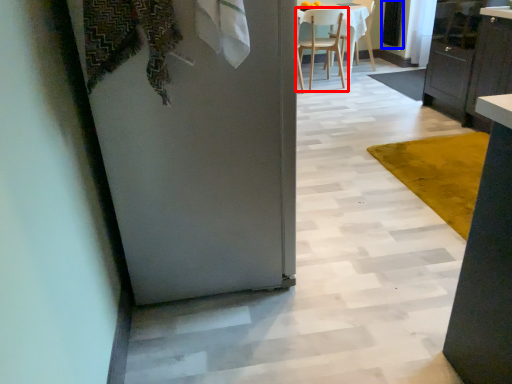
Question: Which of the following is the closest to the observer, chair (highlighted by a red box) or screen door (highlighted by a blue box)?

Choices:
 (A) chair
 (B) screen door

Answer: (A)